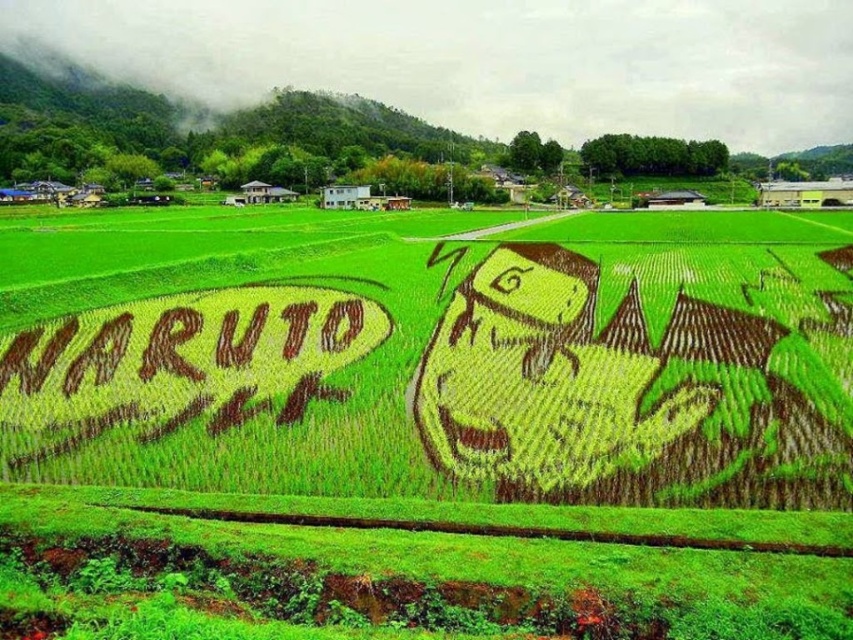
Question: Which point is farther to the camera?

Choices:
 (A) (105, 412)
 (B) (466, 227)

Answer: (B)

Question: Can you confirm if green grass at center is thinner than brown grass at left?

Choices:
 (A) no
 (B) yes

Answer: (A)

Question: Does green grass at center come behind brown grass at left?

Choices:
 (A) no
 (B) yes

Answer: (A)

Question: Is green grass at center to the left of brown grass at left from the viewer's perspective?

Choices:
 (A) yes
 (B) no

Answer: (B)

Question: Which point is farther from the camera taking this photo?

Choices:
 (A) (596, 248)
 (B) (189, 294)

Answer: (A)

Question: Which of the following is the farthest from the observer?

Choices:
 (A) green grass at center
 (B) brown grass at left

Answer: (B)